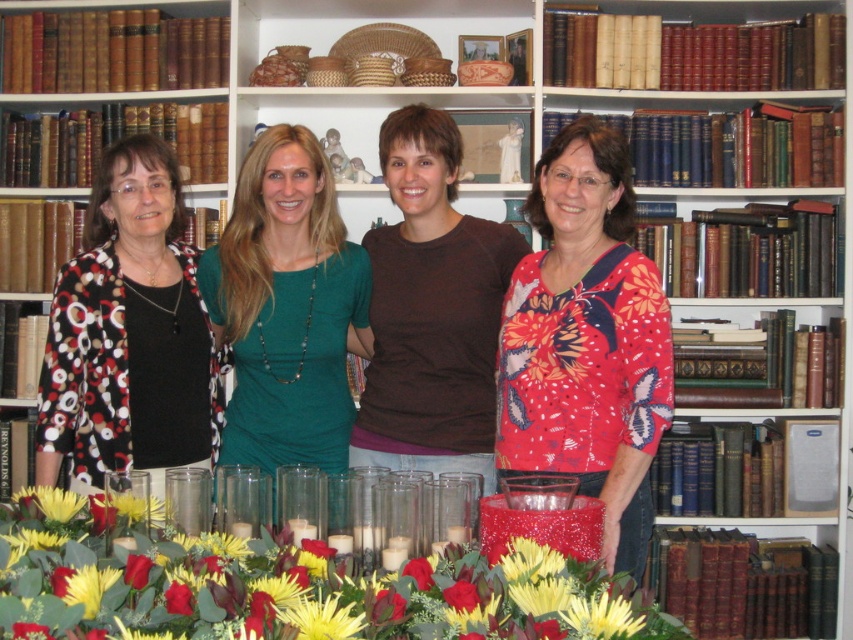
Does printed fabric blouse at left appear over brown cotton shirt at center?

Incorrect, printed fabric blouse at left is not positioned above brown cotton shirt at center.

Is point (102, 273) positioned behind point (387, 237)?

No, it is in front of (387, 237).

Where is `printed fabric blouse at left`? The width and height of the screenshot is (853, 640). printed fabric blouse at left is located at coordinates (129, 333).

Which is more to the left, teal jersey at center or yellow matte flower at center?

From the viewer's perspective, teal jersey at center appears more on the left side.

Is the position of teal jersey at center more distant than that of yellow matte flower at center?

Yes, it is.

Which is behind, point (299, 260) or point (306, 616)?

Point (299, 260)

Find the location of `teal jersey at center`. teal jersey at center is located at coordinates click(x=287, y=307).

Who is taller, floral print blouse at center or printed fabric blouse at left?

Standing taller between the two is floral print blouse at center.

Measure the distance from floral print blouse at center to printed fabric blouse at left.

floral print blouse at center and printed fabric blouse at left are 24.39 inches apart from each other.

Who is more distant from viewer, [540,216] or [138,324]?

The point [138,324] is behind.

At what (x,y) coordinates should I click in order to perform the action: click on floral print blouse at center. Please return your answer as a coordinate pair (x, y). This screenshot has width=853, height=640. Looking at the image, I should click on (585, 340).